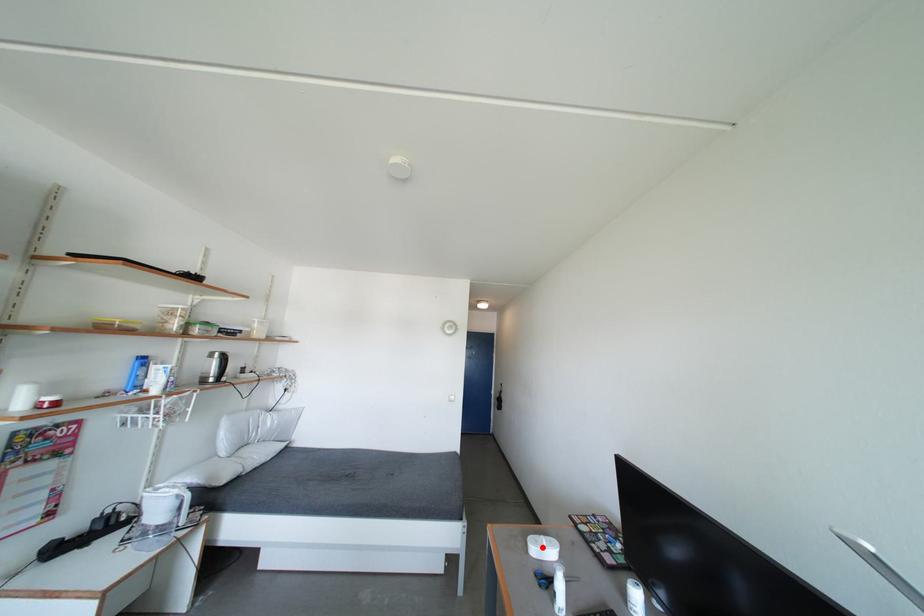
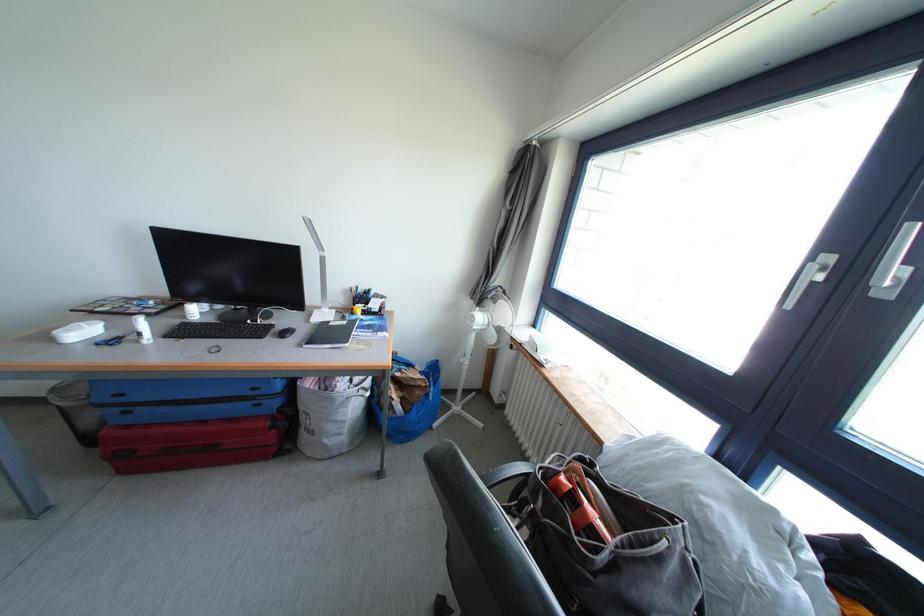
Question: I am providing you with two images of the same scene from different viewpoints. A red point is shown in image1. For the corresponding object point in image2, is it positioned nearer or farther from the camera?

Choices:
 (A) Nearer
 (B) Farther

Answer: (B)